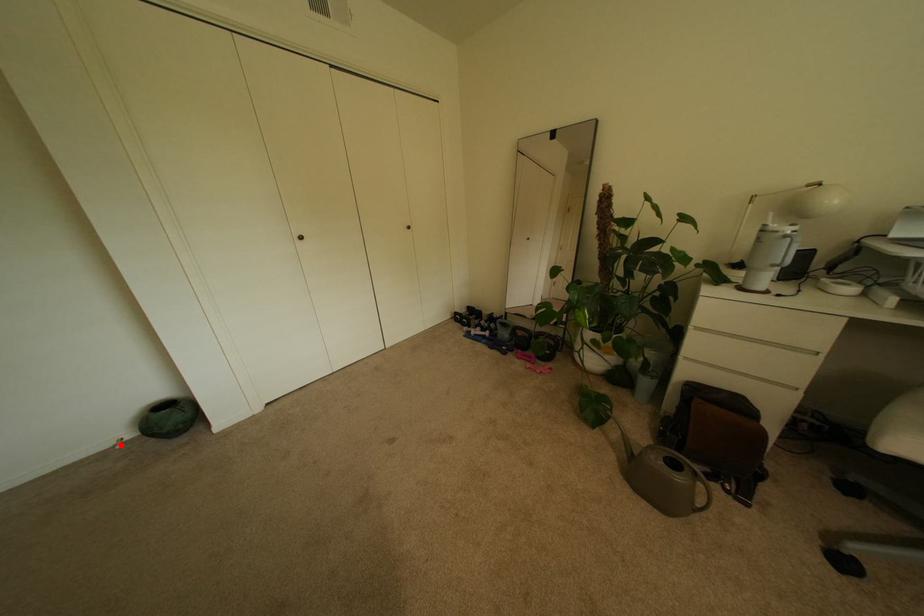
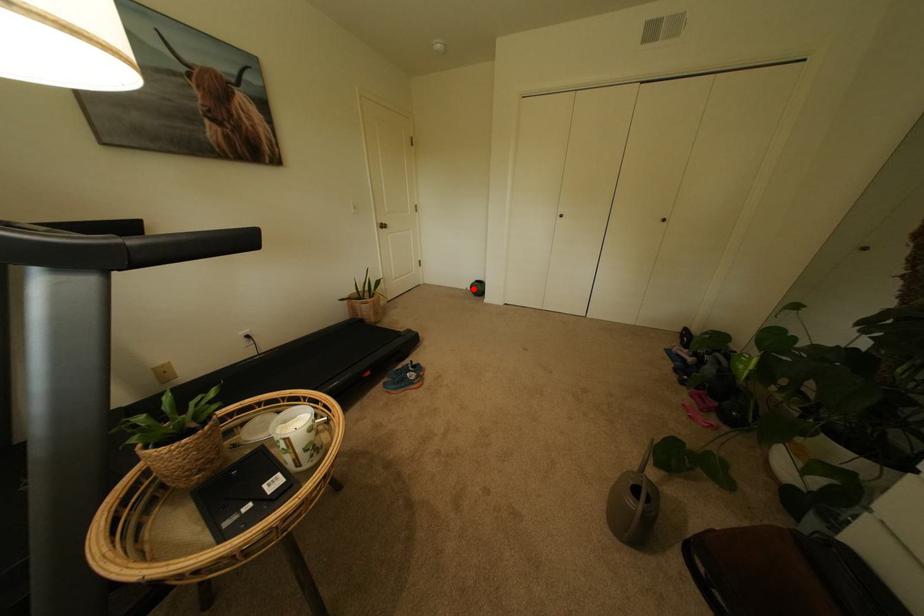
I am providing you with two images of the same scene from different viewpoints. A red point is marked on the first image and another point is marked on the second image. Does the point marked in image1 correspond to the same location as the one in image2?

Yes